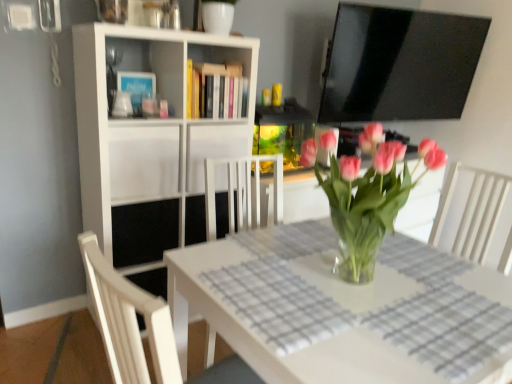
Locate an element on the screen. Image resolution: width=512 pixels, height=384 pixels. vacant space underneath pink glass vase at center (from a real-world perspective) is located at coordinates (345, 278).